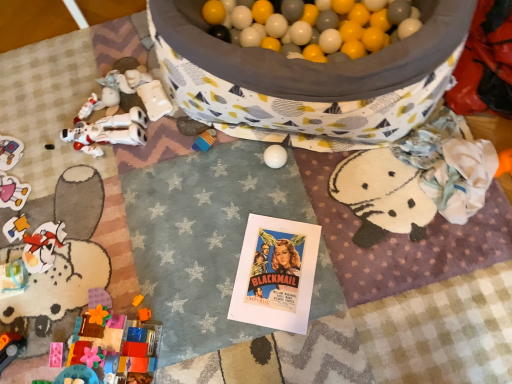
Where is `empty space that is in between white matte robot at left, the third toy positioned from the front, and brick-like plastic blocks at lower left, placed as the third toy when sorted from top to bottom`? The width and height of the screenshot is (512, 384). empty space that is in between white matte robot at left, the third toy positioned from the front, and brick-like plastic blocks at lower left, placed as the third toy when sorted from top to bottom is located at coordinates (113, 234).